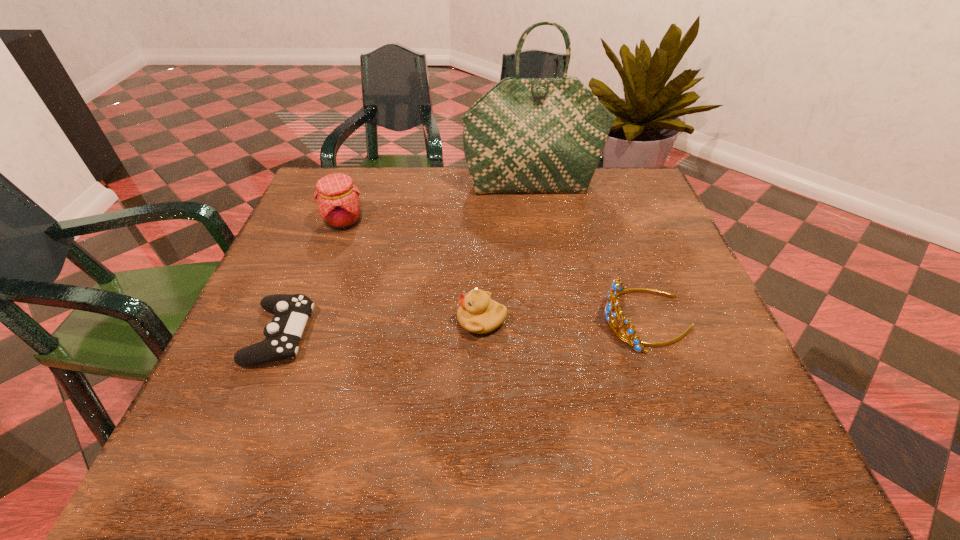
Identify which object is the nearest to the shortest object. Please provide its 2D coordinates. Your answer should be formatted as a tuple, i.e. [(x, y)], where the tuple contains the x and y coordinates of a point satisfying the conditions above.

[(337, 197)]

Where is `blank area in the image that satisfies the following two spatial constraints: 1. on the front side of the tote bag; 2. on the surface of the control`? blank area in the image that satisfies the following two spatial constraints: 1. on the front side of the tote bag; 2. on the surface of the control is located at coordinates (556, 335).